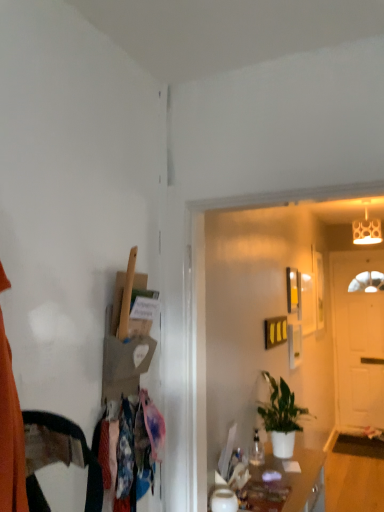
Question: From a real-world perspective, is matte white lampshade at upper right on green matte plant at center?

Choices:
 (A) yes
 (B) no

Answer: (A)

Question: From the image's perspective, is matte white lampshade at upper right under green matte plant at center?

Choices:
 (A) no
 (B) yes

Answer: (A)

Question: Is matte white lampshade at upper right oriented towards green matte plant at center?

Choices:
 (A) yes
 (B) no

Answer: (B)

Question: Is matte white lampshade at upper right smaller than green matte plant at center?

Choices:
 (A) yes
 (B) no

Answer: (A)

Question: Considering the relative sizes of matte white lampshade at upper right and green matte plant at center in the image provided, is matte white lampshade at upper right shorter than green matte plant at center?

Choices:
 (A) yes
 (B) no

Answer: (A)

Question: Based on their positions, is floral fabric dress at left located to the left or right of matte white lampshade at upper right?

Choices:
 (A) right
 (B) left

Answer: (B)

Question: From the image's perspective, is floral fabric dress at left located above or below matte white lampshade at upper right?

Choices:
 (A) below
 (B) above

Answer: (A)

Question: Looking at their shapes, would you say floral fabric dress at left is wider or thinner than matte white lampshade at upper right?

Choices:
 (A) thin
 (B) wide

Answer: (A)

Question: From a real-world perspective, is floral fabric dress at left physically located above or below matte white lampshade at upper right?

Choices:
 (A) below
 (B) above

Answer: (A)

Question: From the image's perspective, is wooden picture frame at upper right located above or below green matte plant at center?

Choices:
 (A) below
 (B) above

Answer: (B)

Question: Based on their positions, is wooden picture frame at upper right located to the left or right of green matte plant at center?

Choices:
 (A) right
 (B) left

Answer: (A)

Question: Does point (319, 266) appear closer or farther from the camera than point (278, 407)?

Choices:
 (A) farther
 (B) closer

Answer: (A)

Question: Relative to green matte plant at center, is wooden picture frame at upper right in front or behind?

Choices:
 (A) front
 (B) behind

Answer: (B)

Question: From their relative heights in the image, would you say white matte door at right is taller or shorter than matte white cabinet at lower center?

Choices:
 (A) tall
 (B) short

Answer: (A)

Question: Does point (359, 266) appear closer or farther from the camera than point (322, 451)?

Choices:
 (A) farther
 (B) closer

Answer: (A)